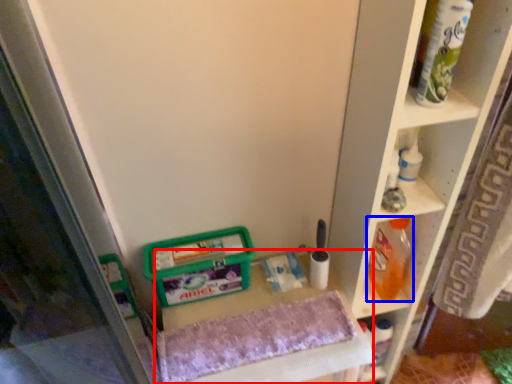
Question: Which point is closer to the camera, vanity (highlighted by a red box) or cleaning product (highlighted by a blue box)?

Choices:
 (A) vanity
 (B) cleaning product

Answer: (A)